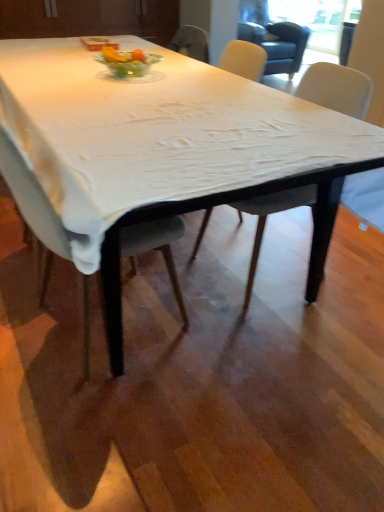
The height and width of the screenshot is (512, 384). Identify the location of free space to the left of clear glass bowl at center. (66, 76).